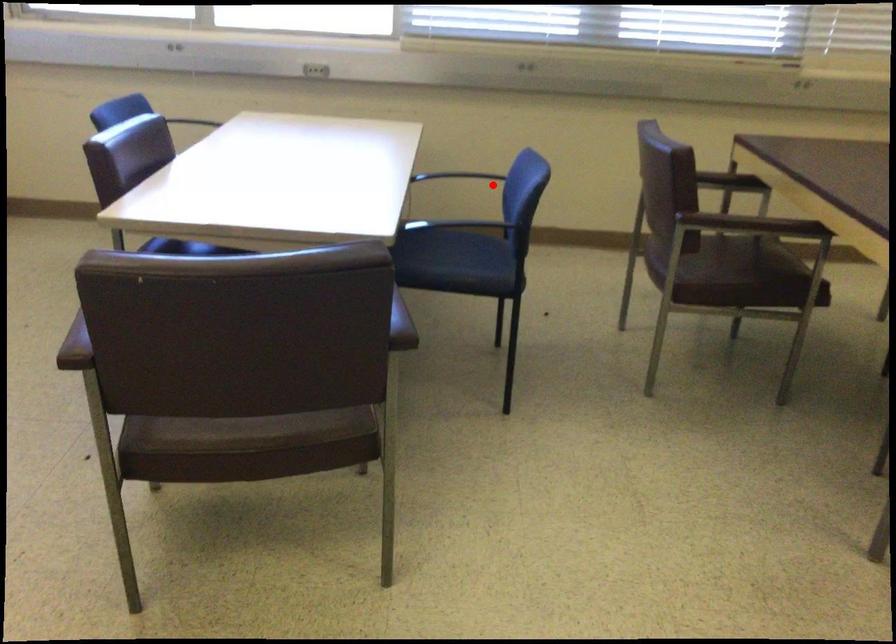
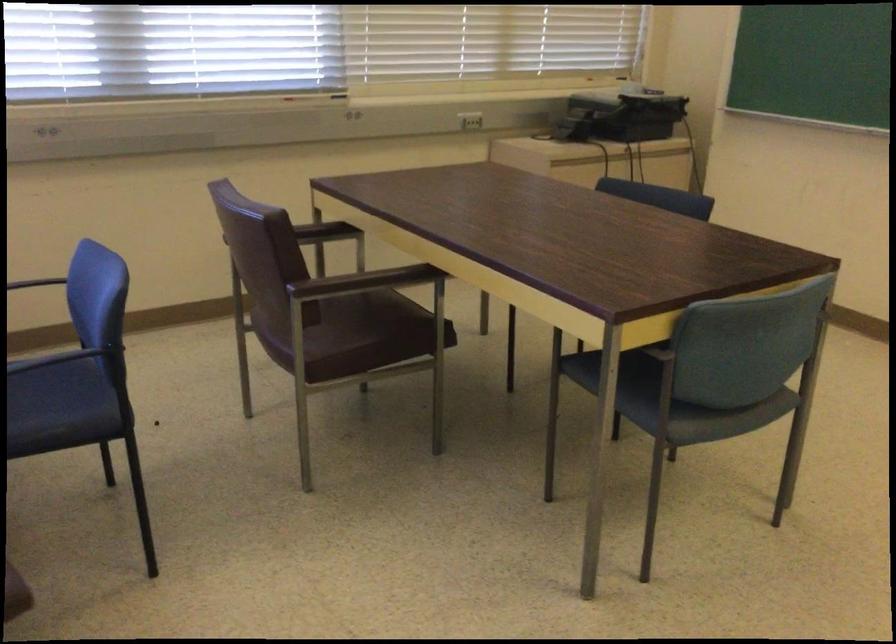
Question: I am providing you with two images of the same scene from different viewpoints. A red point is shown in image1. For the corresponding object point in image2, is it positioned nearer or farther from the camera?

Choices:
 (A) Nearer
 (B) Farther

Answer: (A)